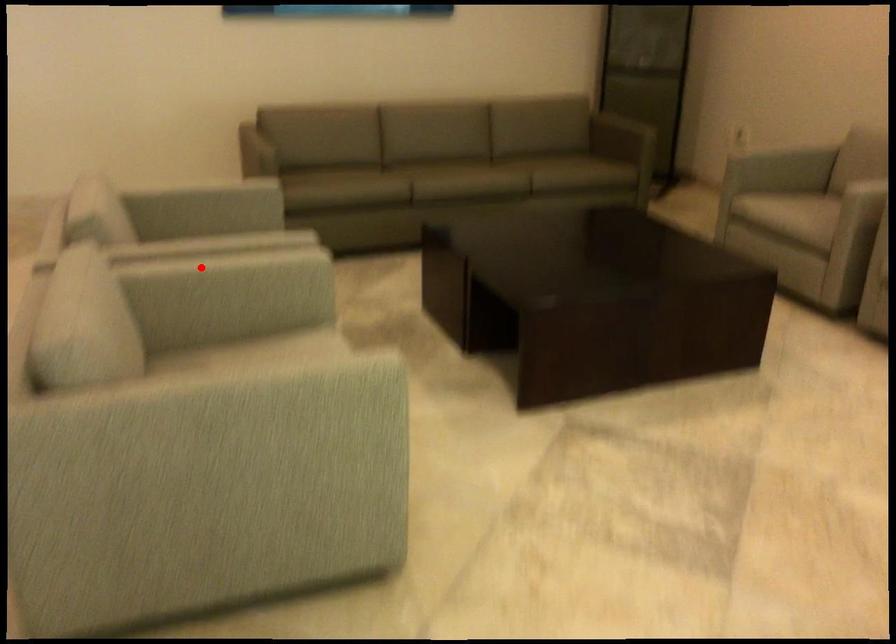
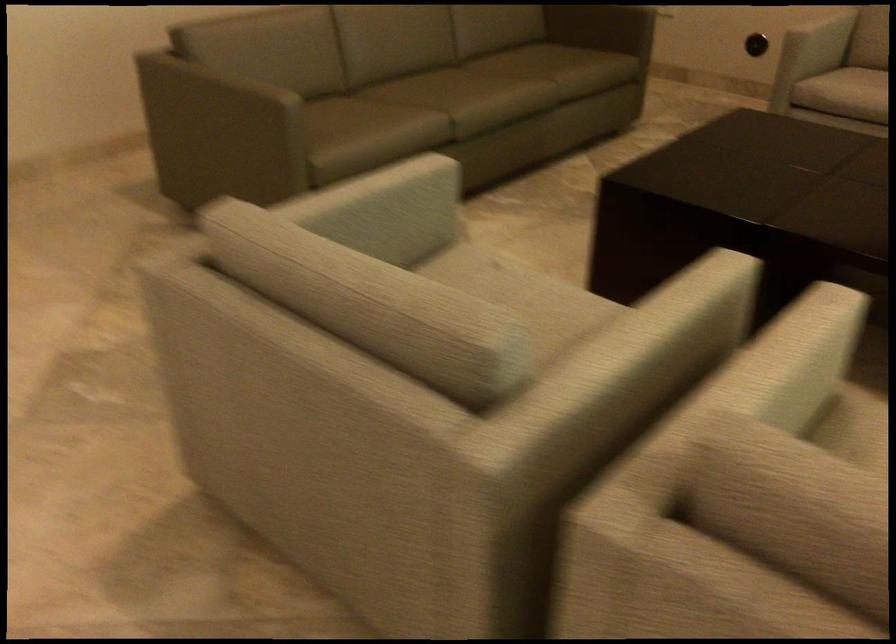
Question: I am providing you with two images of the same scene from different viewpoints. Image1 has a red point marked. In image2, the corresponding 3D location appears at what relative position? Reply with the corresponding letter.

Choices:
 (A) Closer
 (B) Farther

Answer: (A)